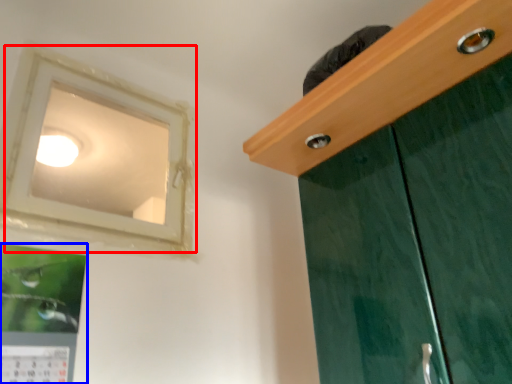
Question: Which point is closer to the camera, window (highlighted by a red box) or picture frame (highlighted by a blue box)?

Choices:
 (A) window
 (B) picture frame

Answer: (B)